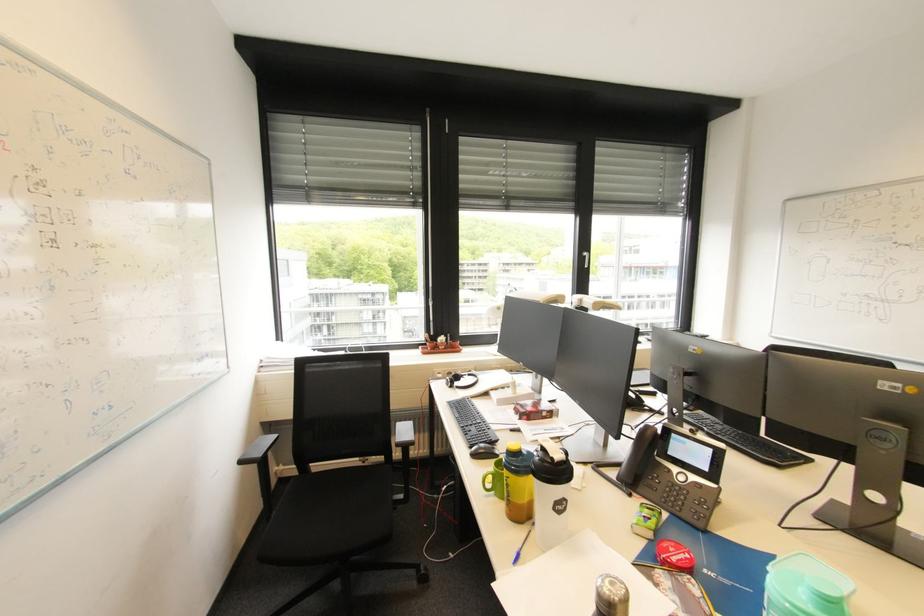
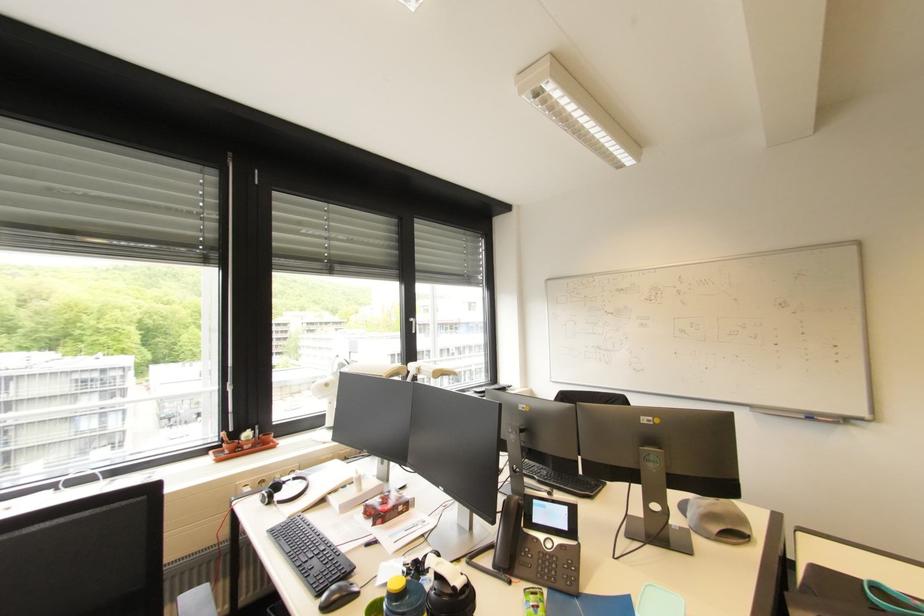
The point at (480, 456) is marked in the first image. Where is the corresponding point in the second image?

(332, 609)